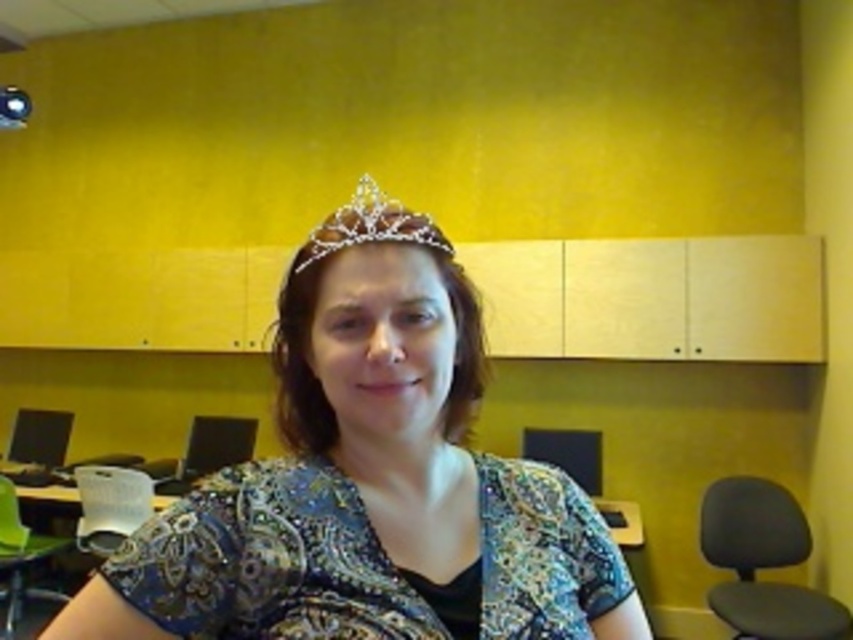
Who is higher up, sparkly blue dress at center or shiny sequined dress at center?

sparkly blue dress at center is higher up.

Does point (561, 508) lie in front of point (201, 497)?

That is False.

The width and height of the screenshot is (853, 640). Describe the element at coordinates (370, 481) in the screenshot. I see `sparkly blue dress at center` at that location.

Locate an element on the screen. The image size is (853, 640). sparkly blue dress at center is located at coordinates (370, 481).

Which is below, shiny sequined dress at center or black fabric swivel chair at lower right?

black fabric swivel chair at lower right

Can you confirm if shiny sequined dress at center is positioned to the right of black fabric swivel chair at lower right?

In fact, shiny sequined dress at center is to the left of black fabric swivel chair at lower right.

Between point (612, 602) and point (782, 564), which one is positioned in front?

Point (612, 602)

The image size is (853, 640). Identify the location of shiny sequined dress at center. (270, 561).

In order to click on sparkly blue dress at center in this screenshot , I will do `click(370, 481)`.

Does point (593, 541) come behind point (802, 637)?

No, (593, 541) is closer to viewer.

Find the location of a particular element. The width and height of the screenshot is (853, 640). sparkly blue dress at center is located at coordinates (370, 481).